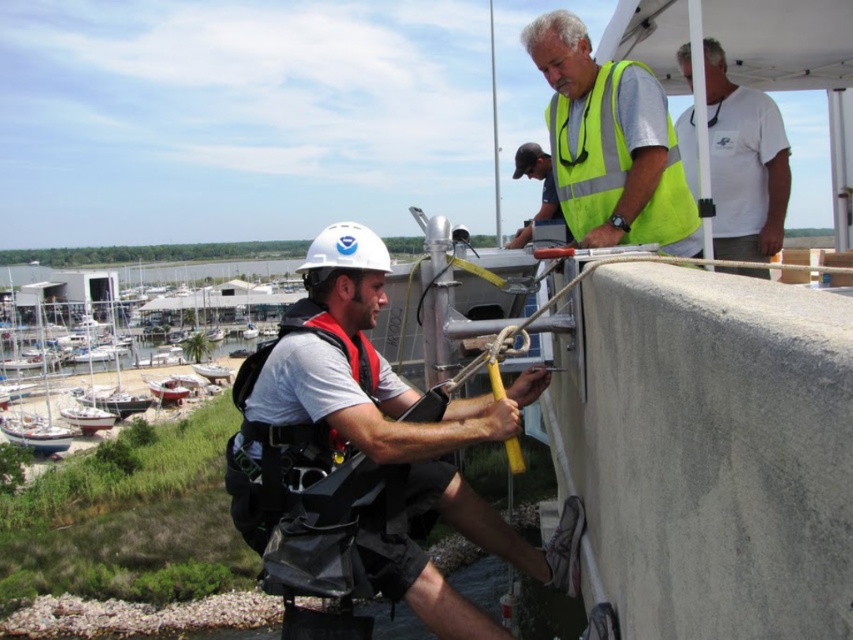
Question: Estimate the real-world distances between objects in this image. Which object is farther from the dark gray baseball cap at upper center?

Choices:
 (A) white matte helmet at center
 (B) yellow reflective vest at upper right

Answer: (A)

Question: Can you confirm if yellow reflective vest at upper right is bigger than dark gray baseball cap at upper center?

Choices:
 (A) yes
 (B) no

Answer: (B)

Question: From the image, what is the correct spatial relationship of yellow reflective vest at upper right in relation to dark gray baseball cap at upper center?

Choices:
 (A) right
 (B) left

Answer: (A)

Question: Estimate the real-world distances between objects in this image. Which object is farther from the white matte helmet at center?

Choices:
 (A) yellow reflective vest at upper right
 (B) dark gray baseball cap at upper center

Answer: (B)

Question: Can you confirm if neon yellow reflective vest at upper center is thinner than dark gray baseball cap at upper center?

Choices:
 (A) no
 (B) yes

Answer: (B)

Question: Which object is farther from the camera taking this photo?

Choices:
 (A) white matte helmet at center
 (B) yellow reflective vest at upper right

Answer: (B)